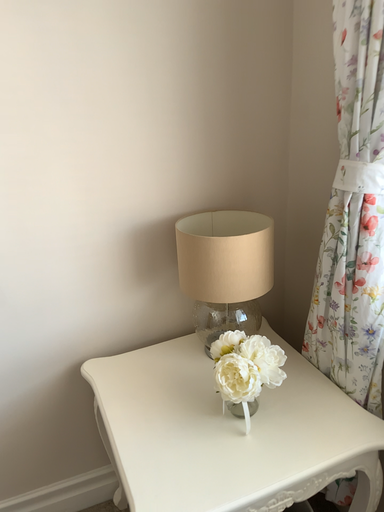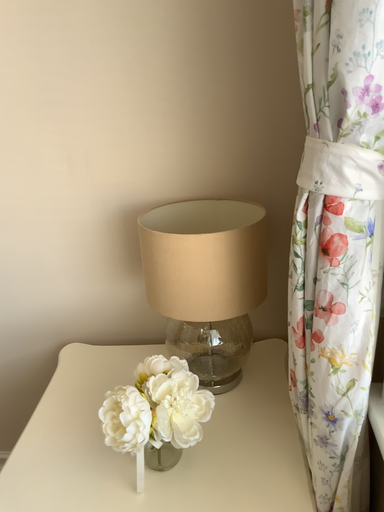
Question: Which way did the camera rotate in the video?

Choices:
 (A) rotated left
 (B) rotated right

Answer: (A)